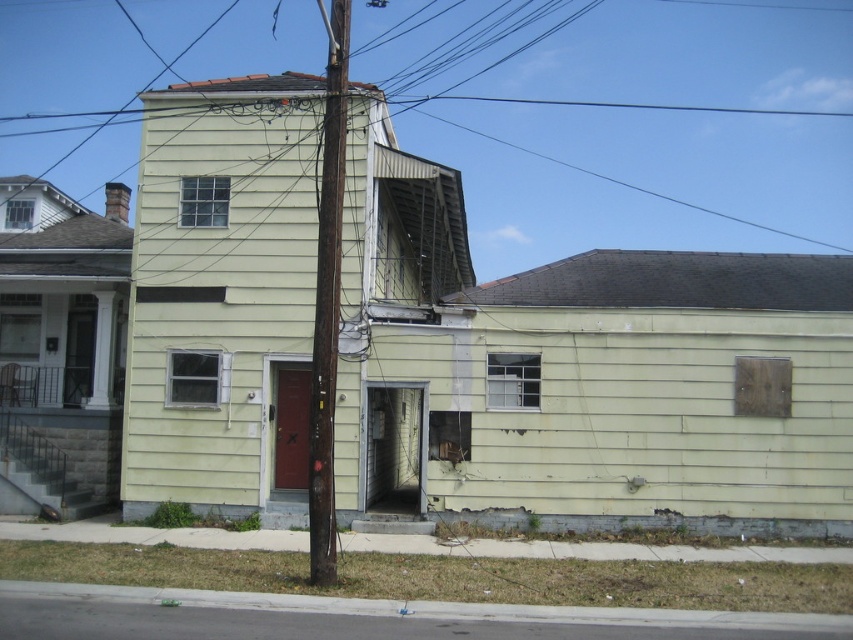
Question: Which point appears closest to the camera in this image?

Choices:
 (A) (316, 547)
 (B) (448, 97)

Answer: (A)

Question: Can you confirm if metallic wire at upper center is smaller than brown wooden telegraph pole at center?

Choices:
 (A) no
 (B) yes

Answer: (A)

Question: Observing the image, what is the correct spatial positioning of metallic wire at upper center in reference to brown wooden telegraph pole at center?

Choices:
 (A) below
 (B) above

Answer: (B)

Question: Among these points, which one is farthest from the camera?

Choices:
 (A) [x=618, y=88]
 (B) [x=326, y=72]

Answer: (A)

Question: Is metallic wire at upper center smaller than brown wooden telegraph pole at center?

Choices:
 (A) no
 (B) yes

Answer: (A)